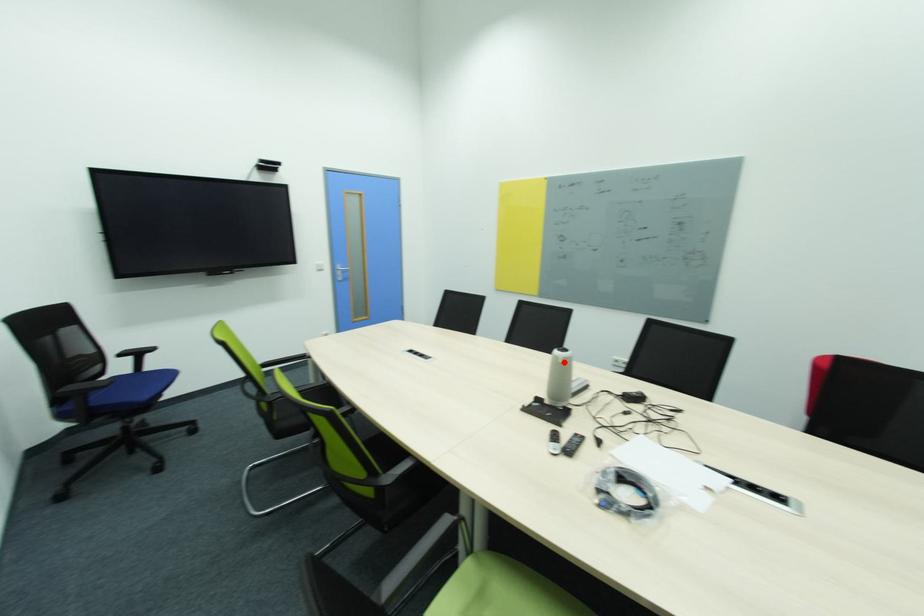
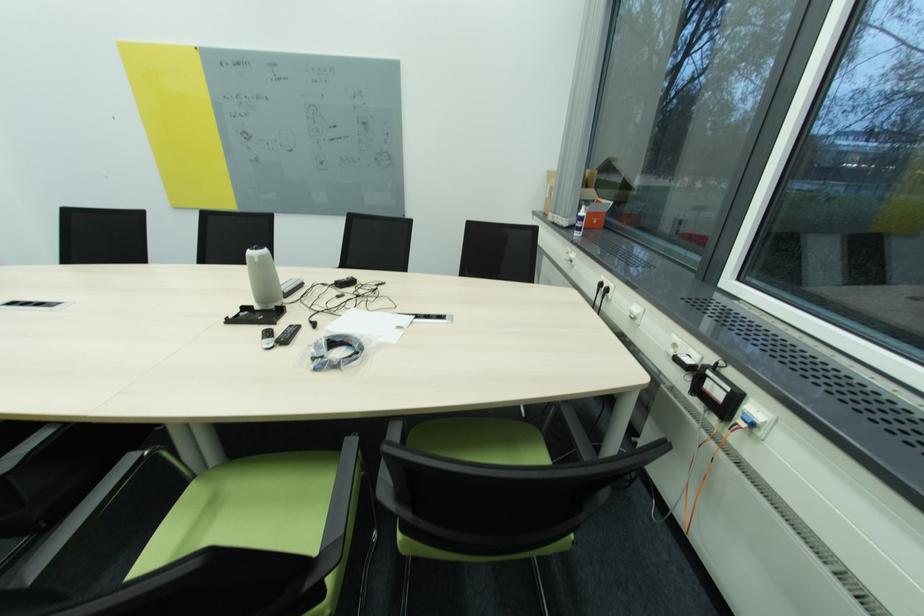
Question: I am providing you with two images of the same scene from different viewpoints. A red point is shown in image1. For the corresponding object point in image2, is it positioned nearer or farther from the camera?

Choices:
 (A) Nearer
 (B) Farther

Answer: (A)